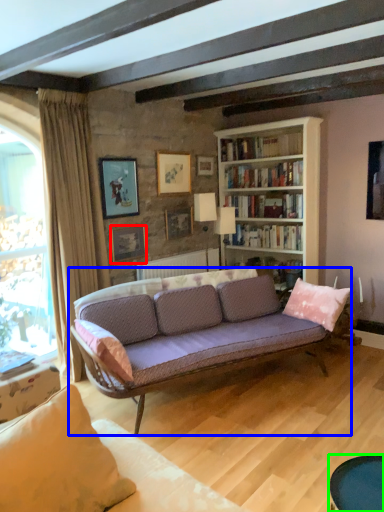
Question: Considering the real-world distances, which object is farthest from picture frame (highlighted by a red box)? studio couch (highlighted by a blue box) or table (highlighted by a green box)?

Choices:
 (A) studio couch
 (B) table

Answer: (B)